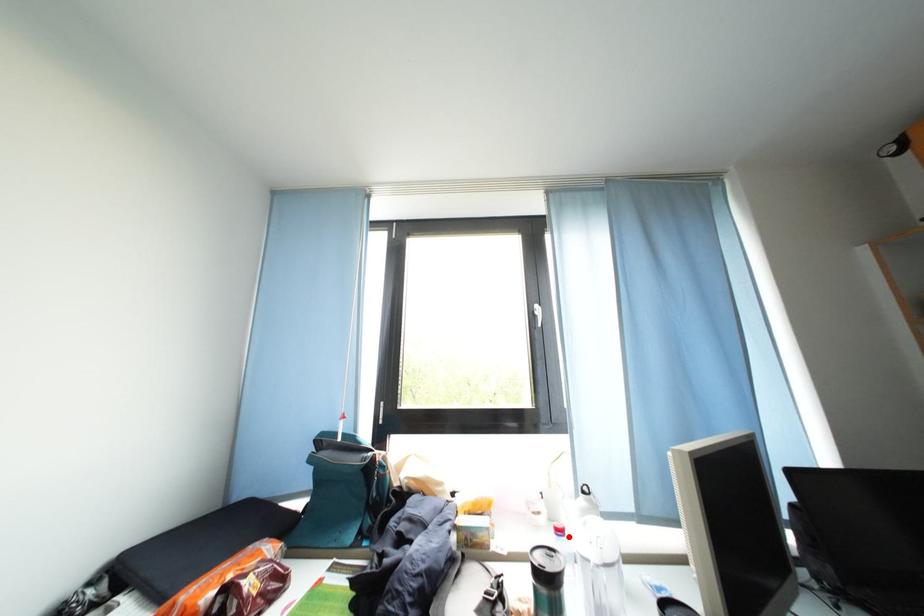
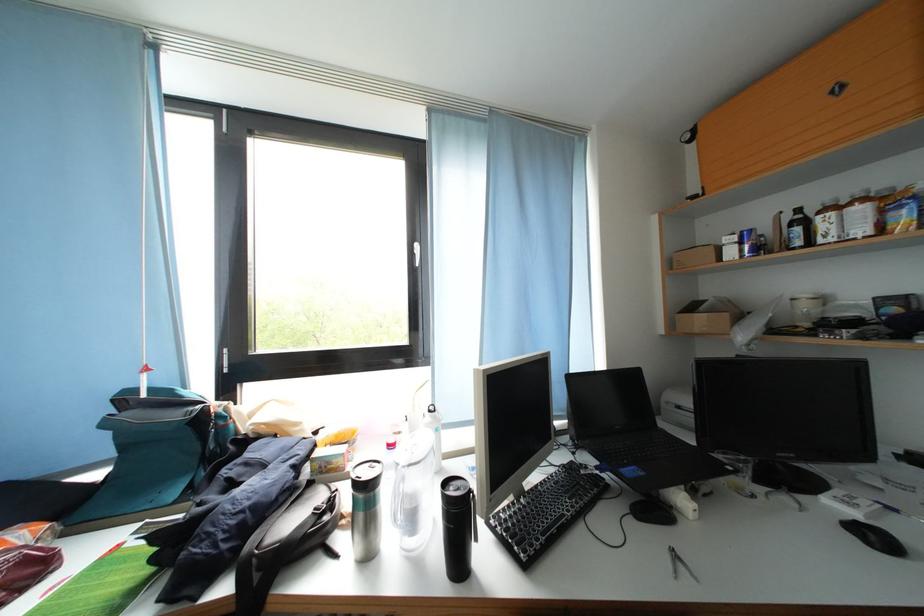
The point at the highlighted location is marked in the first image. Where is the corresponding point in the second image?

(398, 451)